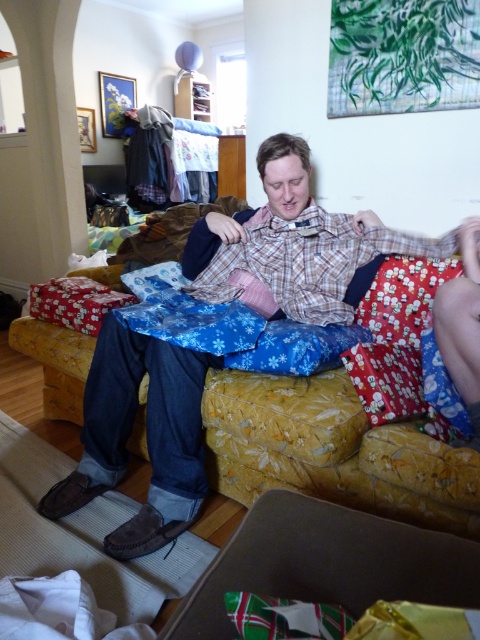
You are standing in the room and want to pick up an object located at point [260,444] and another object at point [441,557]. Which point is closer to you?

Point [260,444] is closer to you than point [441,557] because it is further to the viewer.

You are a guest at a party and want to sit on the yellow floral fabric couch at center. However, there is a green paper gift at lower center in the way. Can you move the gift to the side to make space?

The yellow floral fabric couch at center is wider than the green paper gift at lower center, so you can move the gift to the side to make space.